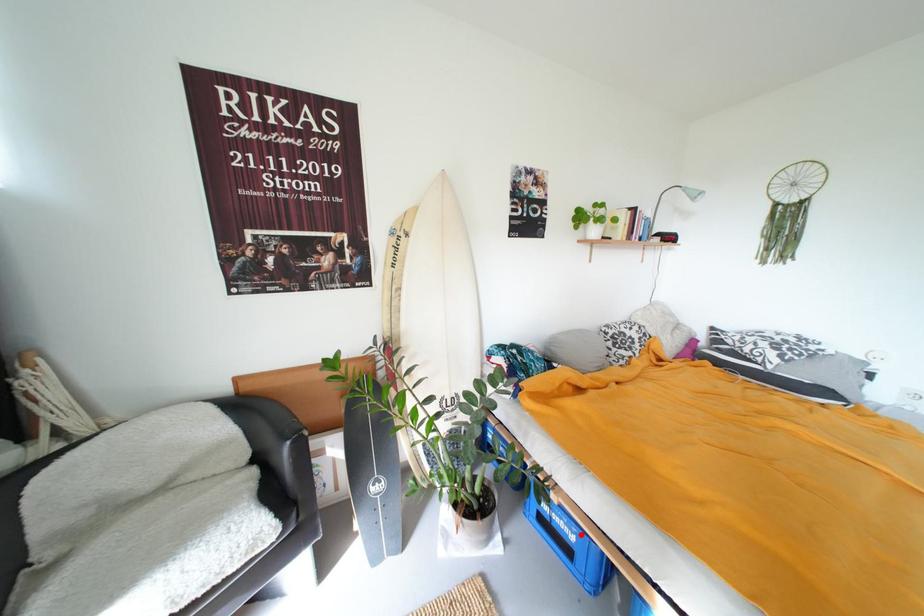
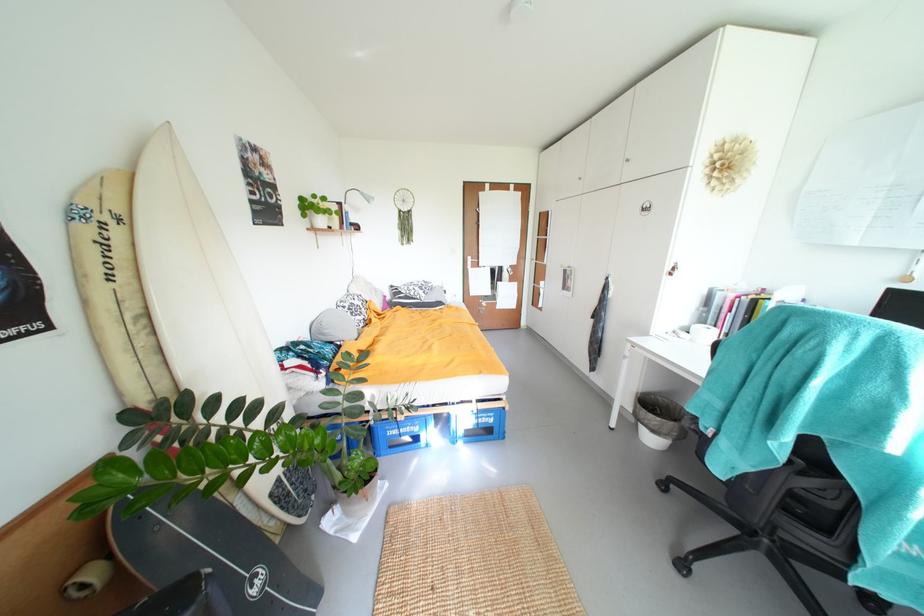
Where in the second image is the point corresponding to the highlighted location from the first image?

(423, 428)